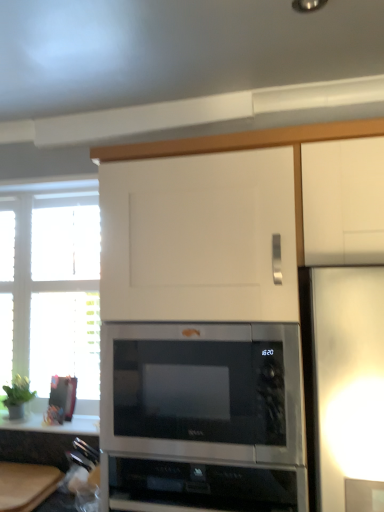
Question: From the image's perspective, is black glass cooktop at lower center located above stainless steel microwave at center?

Choices:
 (A) no
 (B) yes

Answer: (A)

Question: Is the depth of black glass cooktop at lower center greater than that of stainless steel microwave at center?

Choices:
 (A) yes
 (B) no

Answer: (B)

Question: From the image's perspective, would you say black glass cooktop at lower center is shown under stainless steel microwave at center?

Choices:
 (A) no
 (B) yes

Answer: (B)

Question: Can you confirm if black glass cooktop at lower center is wider than stainless steel microwave at center?

Choices:
 (A) no
 (B) yes

Answer: (B)

Question: Is stainless steel microwave at center surrounded by black glass cooktop at lower center?

Choices:
 (A) yes
 (B) no

Answer: (B)

Question: From a real-world perspective, is black glass cooktop at lower center physically below stainless steel microwave at center?

Choices:
 (A) no
 (B) yes

Answer: (B)

Question: Is black glass cooktop at lower center outside of white wooden window at left?

Choices:
 (A) yes
 (B) no

Answer: (A)

Question: From the image's perspective, is black glass cooktop at lower center located beneath white wooden window at left?

Choices:
 (A) no
 (B) yes

Answer: (B)

Question: Is the position of black glass cooktop at lower center less distant than that of white wooden window at left?

Choices:
 (A) yes
 (B) no

Answer: (A)

Question: Does black glass cooktop at lower center have a greater width compared to white wooden window at left?

Choices:
 (A) yes
 (B) no

Answer: (A)

Question: Can you confirm if black glass cooktop at lower center is taller than white wooden window at left?

Choices:
 (A) no
 (B) yes

Answer: (A)

Question: From the image's perspective, is black glass cooktop at lower center above white wooden window at left?

Choices:
 (A) yes
 (B) no

Answer: (B)

Question: Is white glossy countertop at lower left bigger than white wooden window at left?

Choices:
 (A) no
 (B) yes

Answer: (A)